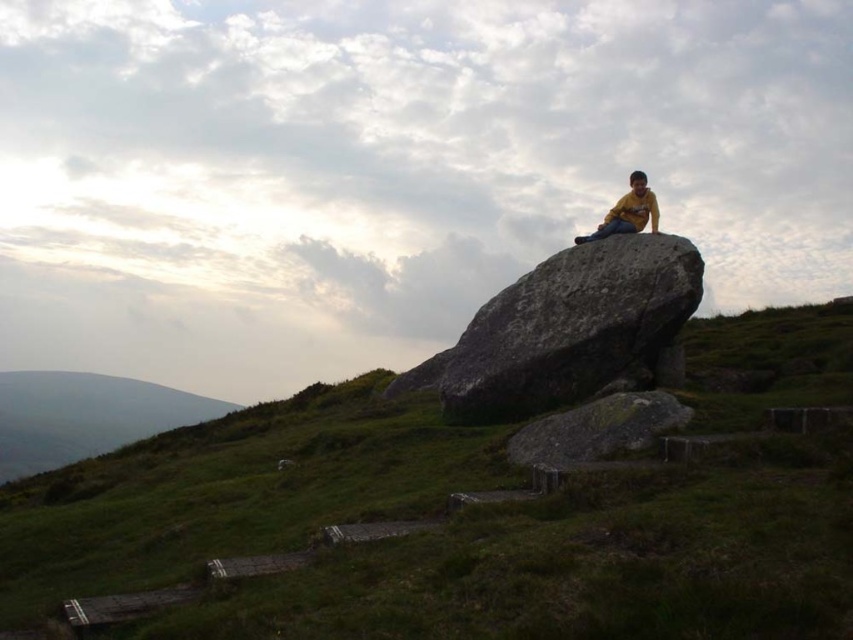
Question: Considering the relative positions of green grassy at upper center and gray rough boulder at upper center in the image provided, where is green grassy at upper center located with respect to gray rough boulder at upper center?

Choices:
 (A) below
 (B) above

Answer: (A)

Question: Is green grassy at upper center further to camera compared to yellow matte shirt at upper center?

Choices:
 (A) yes
 (B) no

Answer: (B)

Question: Based on their relative distances, which object is farther from the yellow matte shirt at upper center?

Choices:
 (A) gray rough boulder at upper center
 (B) green grassy at upper center
 (C) green grassy hillside at lower left

Answer: (C)

Question: Which object is the closest to the gray rough boulder at upper center?

Choices:
 (A) yellow matte shirt at upper center
 (B) green grassy hillside at lower left

Answer: (A)

Question: Is green grassy hillside at lower left closer to camera compared to yellow matte shirt at upper center?

Choices:
 (A) yes
 (B) no

Answer: (B)

Question: Which is nearer to the gray rough boulder at upper center?

Choices:
 (A) yellow matte shirt at upper center
 (B) green grassy hillside at lower left

Answer: (A)